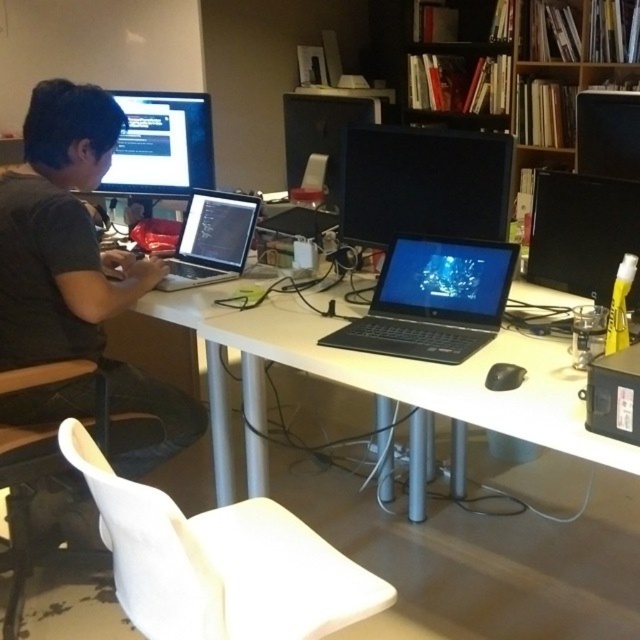
Question: Is white plastic desk at center positioned behind silver metallic laptop at center?

Choices:
 (A) no
 (B) yes

Answer: (A)

Question: Can you confirm if white plastic desk at center is positioned above black matte laptop at center?

Choices:
 (A) yes
 (B) no

Answer: (B)

Question: Among these points, which one is farthest from the camera?

Choices:
 (A) (150, 266)
 (B) (576, 244)
 (C) (564, 141)

Answer: (C)

Question: Which point appears farthest from the camera in this image?

Choices:
 (A) (563, 285)
 (B) (96, 284)

Answer: (A)

Question: Considering the real-world distances, which object is farthest from the matte black monitor at right?

Choices:
 (A) white plastic desk at center
 (B) black matte laptop at center
 (C) silver metallic laptop at center
 (D) white plastic chair at lower left

Answer: (C)

Question: Can you confirm if black matte laptop at left is bigger than matte black monitor at right?

Choices:
 (A) yes
 (B) no

Answer: (A)